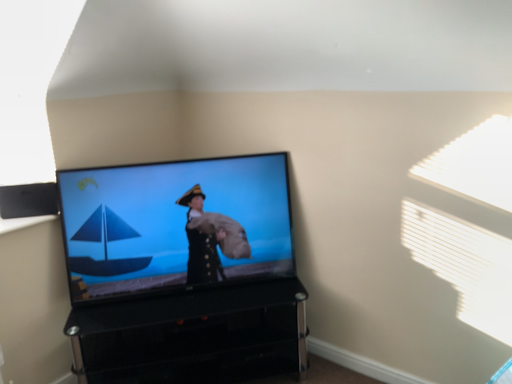
Question: Can you confirm if black plastic speaker at upper left is bigger than black glossy tv stand at lower center?

Choices:
 (A) yes
 (B) no

Answer: (B)

Question: Is the position of black plastic speaker at upper left less distant than that of black glossy tv stand at lower center?

Choices:
 (A) no
 (B) yes

Answer: (A)

Question: Can you confirm if black plastic speaker at upper left is shorter than black glossy tv stand at lower center?

Choices:
 (A) no
 (B) yes

Answer: (B)

Question: From a real-world perspective, is black plastic speaker at upper left positioned under black glossy tv stand at lower center based on gravity?

Choices:
 (A) no
 (B) yes

Answer: (A)

Question: Is black plastic speaker at upper left not close to black glossy tv stand at lower center?

Choices:
 (A) no
 (B) yes

Answer: (A)

Question: Is black plastic speaker at upper left smaller than black glossy tv stand at lower center?

Choices:
 (A) no
 (B) yes

Answer: (B)

Question: Can you confirm if black plastic speaker at upper left is taller than matte black tv at center?

Choices:
 (A) yes
 (B) no

Answer: (B)

Question: Does black plastic speaker at upper left turn towards matte black tv at center?

Choices:
 (A) yes
 (B) no

Answer: (B)

Question: From a real-world perspective, is black plastic speaker at upper left positioned over matte black tv at center based on gravity?

Choices:
 (A) no
 (B) yes

Answer: (B)

Question: Is matte black tv at center at the back of black plastic speaker at upper left?

Choices:
 (A) no
 (B) yes

Answer: (A)

Question: From the image's perspective, is black plastic speaker at upper left located beneath matte black tv at center?

Choices:
 (A) yes
 (B) no

Answer: (B)

Question: Can you confirm if black plastic speaker at upper left is positioned to the left of matte black tv at center?

Choices:
 (A) no
 (B) yes

Answer: (B)

Question: Is black glossy tv stand at lower center wider than black plastic speaker at upper left?

Choices:
 (A) no
 (B) yes

Answer: (B)